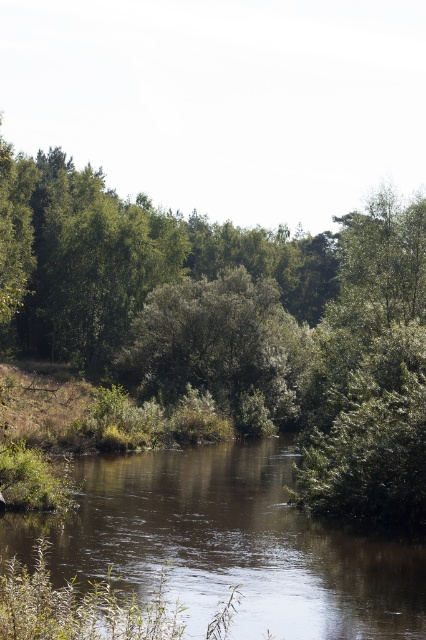
Question: Considering the real-world distances, which object is farthest from the brown smooth water at center?

Choices:
 (A) green leafy forest at center
 (B) green leafy tree at center

Answer: (A)

Question: Does brown smooth water at center lie behind green leafy tree at center?

Choices:
 (A) yes
 (B) no

Answer: (B)

Question: Estimate the real-world distances between objects in this image. Which object is farther from the brown smooth water at center?

Choices:
 (A) green leafy tree at center
 (B) green leafy forest at center

Answer: (B)

Question: Can you confirm if green leafy forest at center is positioned above brown smooth water at center?

Choices:
 (A) yes
 (B) no

Answer: (A)

Question: Is green leafy forest at center positioned behind brown smooth water at center?

Choices:
 (A) no
 (B) yes

Answer: (B)

Question: Which object is farther from the camera taking this photo?

Choices:
 (A) brown smooth water at center
 (B) green leafy forest at center
 (C) green leafy tree at center

Answer: (C)